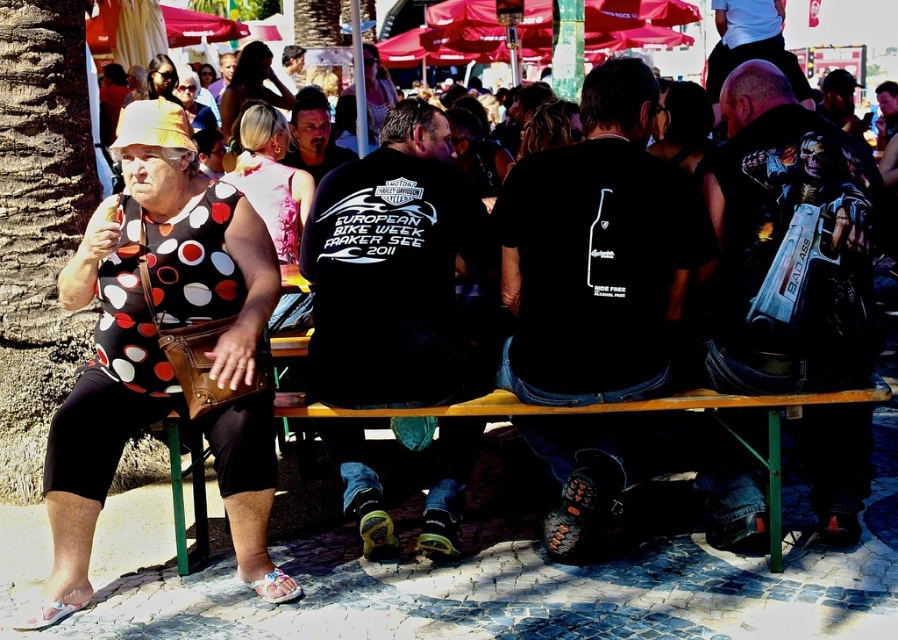
Question: Which of these objects is positioned closest to the polka dot fabric dress at left?

Choices:
 (A) blonde hair at upper center
 (B) polka dot fabric dress at upper left

Answer: (B)

Question: Which point is farther to the camera?

Choices:
 (A) (284, 188)
 (B) (234, 136)

Answer: (B)

Question: Is polka dot fabric dress at left below blonde hair at upper center?

Choices:
 (A) yes
 (B) no

Answer: (A)

Question: Is the position of polka dot fabric dress at upper left less distant than that of blonde hair at upper center?

Choices:
 (A) yes
 (B) no

Answer: (A)

Question: Among these points, which one is nearest to the camera?

Choices:
 (A) (163, 161)
 (B) (224, 179)
 (C) (286, 100)

Answer: (A)

Question: Can you confirm if polka dot fabric dress at upper left is smaller than blonde hair at upper center?

Choices:
 (A) no
 (B) yes

Answer: (A)